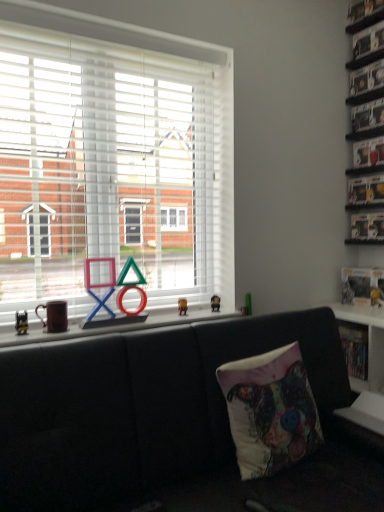
Question: Is white plastic shelf at lower right, which is the first shelf from bottom to top, situated inside clear plastic shelf at upper right, acting as the 5th shelf starting from the bottom, or outside?

Choices:
 (A) outside
 (B) inside

Answer: (A)

Question: Based on their sizes in the image, would you say white plastic shelf at lower right, which is the first shelf from bottom to top, is bigger or smaller than clear plastic shelf at upper right, acting as the 5th shelf starting from the bottom?

Choices:
 (A) big
 (B) small

Answer: (A)

Question: Which object is the closest to the metallic gold figurine at center, placed as the second miniature when sorted from back to front?

Choices:
 (A) white plastic window at center
 (B) clear plastic shelf at upper right, marked as the 1th shelf in a top-to-bottom arrangement
 (C) metallic gold figurine at center, placed as the first miniature when sorted from right to left
 (D) white plastic shelf at lower right, which is counted as the 5th shelf, starting from the top
 (E) black leather couch at lower center

Answer: (C)

Question: Which object is positioned farthest from the black leather couch at lower center?

Choices:
 (A) metallic gold figurine at center, the 2th miniature positioned from the right
 (B) white plastic shelf at lower right, which is the first shelf from bottom to top
 (C) matte plastic game controller at center
 (D) white plastic window at center
 (E) metallic gold figurine at center, which ranks as the second miniature in front-to-back order

Answer: (B)